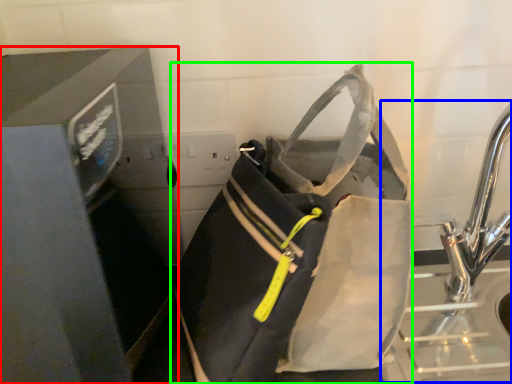
Question: Estimate the real-world distances between objects in this image. Which object is farther from appliance (highlighted by a red box), sink (highlighted by a blue box) or luggage and bags (highlighted by a green box)?

Choices:
 (A) sink
 (B) luggage and bags

Answer: (A)